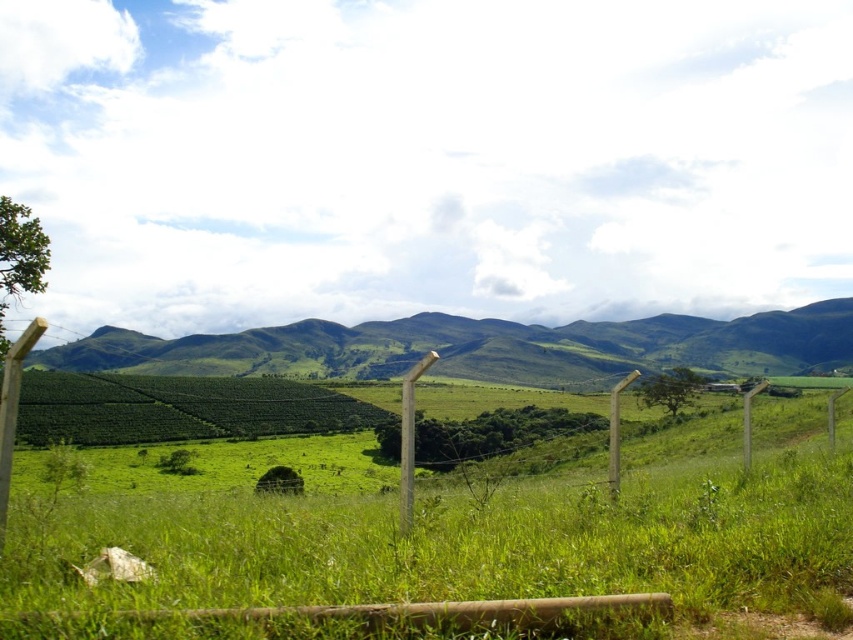
Between point (270, 330) and point (404, 515), which one is positioned in front?

Point (404, 515) is in front.

Where is `green grassy hill at center`? The height and width of the screenshot is (640, 853). green grassy hill at center is located at coordinates [x=485, y=348].

What are the coordinates of `green grassy hill at center` in the screenshot? It's located at (485, 348).

In the scene shown: Is green grassy field at center bigger than green grassy hill at center?

No.

Is point (265, 525) closer to camera compared to point (334, 332)?

Yes.

Identify the location of green grassy field at center. (457, 538).

The height and width of the screenshot is (640, 853). I want to click on green grassy field at center, so click(457, 538).

Where is `green grassy field at center`? green grassy field at center is located at coordinates (457, 538).